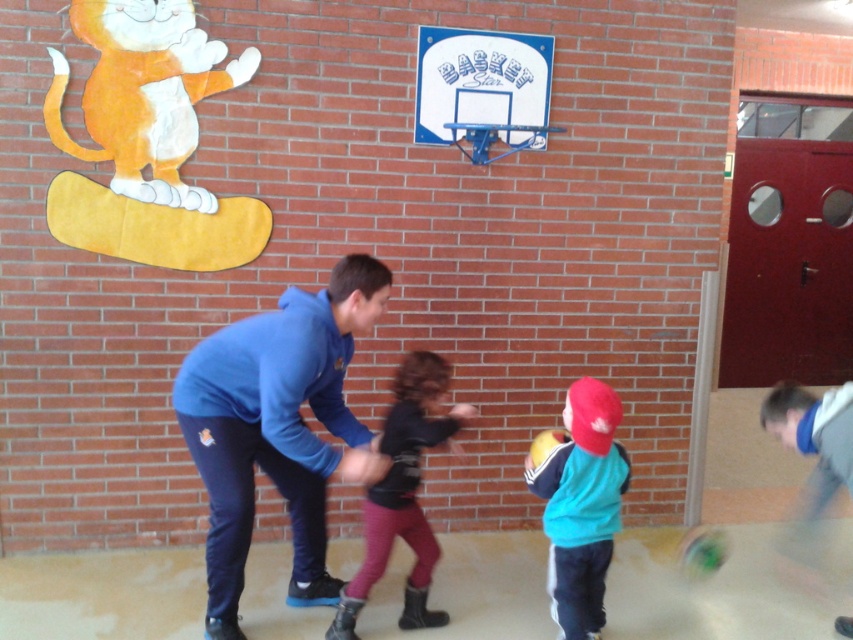
You are a photographer standing in the gymnasium. You see the blue fleece jacket at center and the velvet black jacket at center. Which one do you need to adjust your camera angle upwards to capture properly?

You need to adjust your camera angle upwards to capture the blue fleece jacket at center properly because it is much taller than the velvet black jacket at center.

You are a visitor in the gymnasium and want to locate the teal matte jacket at center and the white plastic basketball hoop at upper center. According to their positions, which object is closer to the right side of the image?

The teal matte jacket at center is closer to the right side of the image because it is positioned to the right of the white plastic basketball hoop at upper center.

You are a photographer trying to capture a group photo of the blue fleece jacket at center and the velvet black jacket at center. To ensure both are in frame, should you position the camera to the left or the right of the subjects?

Since the blue fleece jacket at center is to the left of the velvet black jacket at center, you should position the camera to the right of the subjects to ensure both are in frame.